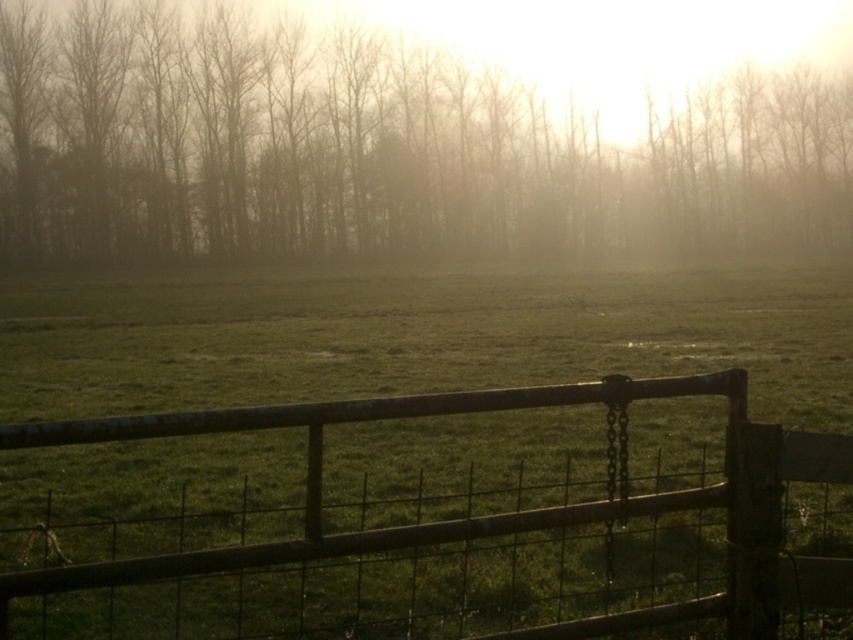
Is point (0, 68) farther from viewer compared to point (115, 576)?

Yes, it is.

Does silhouetted bare trees at upper center appear on the left side of rusty wood gate at center?

No, silhouetted bare trees at upper center is not to the left of rusty wood gate at center.

Which is in front, point (566, 150) or point (329, 419)?

Point (329, 419) is in front.

The image size is (853, 640). In order to click on silhouetted bare trees at upper center in this screenshot , I will do `click(378, 150)`.